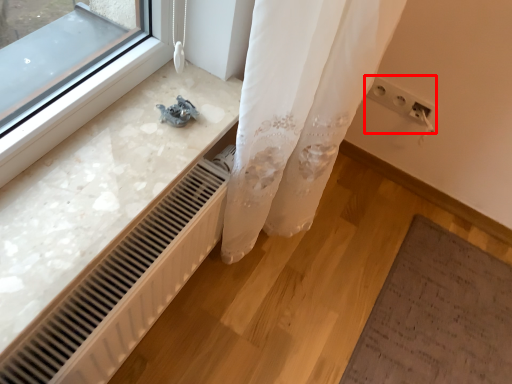
Question: Where is electric outlet (annotated by the red box) located in relation to radiator in the image?

Choices:
 (A) left
 (B) right

Answer: (B)